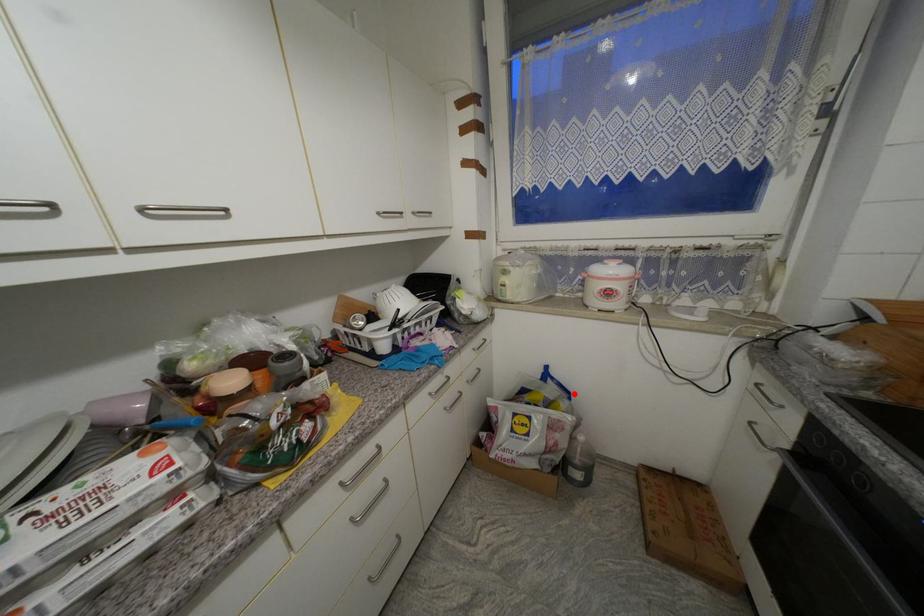
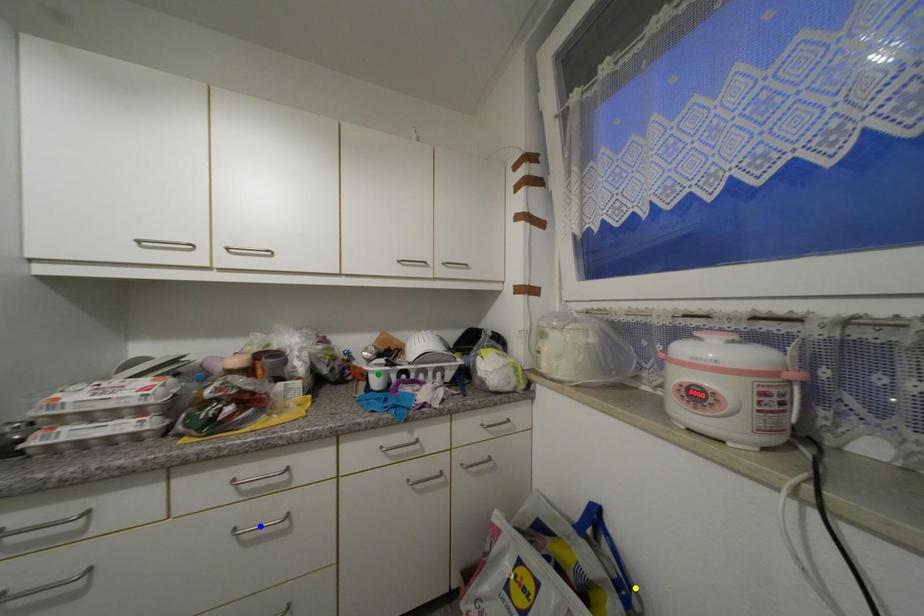
Question: I am providing you with two images of the same scene from different viewpoints. A red point is marked on the first image. You are given multiple points on the second image. Which spot in image 2 lines up with the point in image 1?

Choices:
 (A) blue point
 (B) green point
 (C) yellow point

Answer: (C)